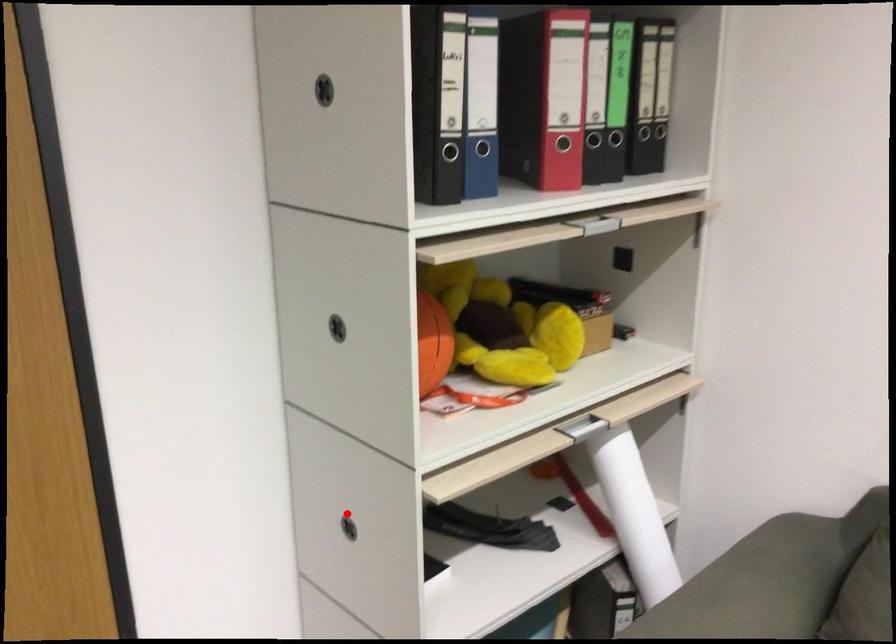
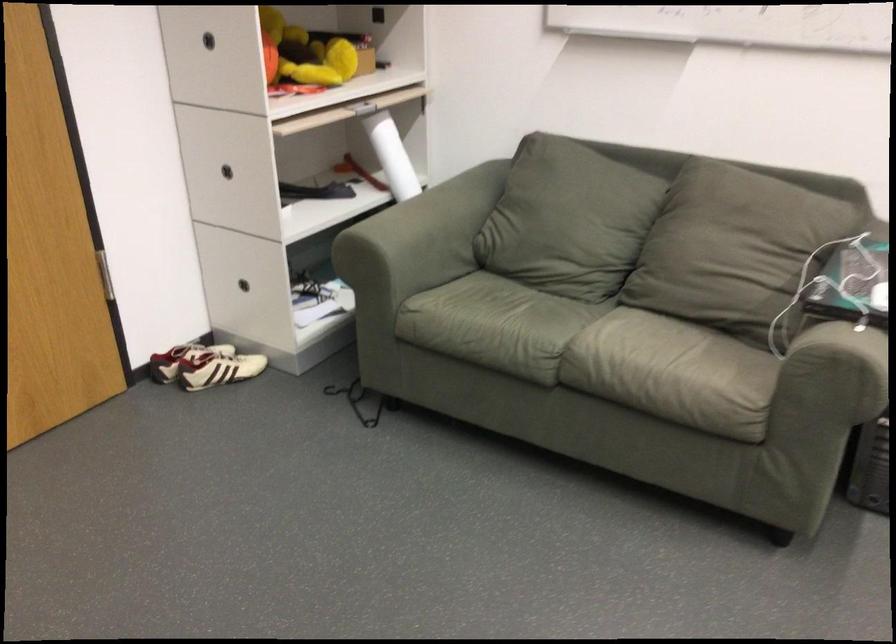
Question: A red point is marked in image1. In image2, is the corresponding 3D point closer to the camera or farther? Reply with the corresponding letter.

Choices:
 (A) The corresponding 3D point is closer.
 (B) The corresponding 3D point is farther.

Answer: (B)